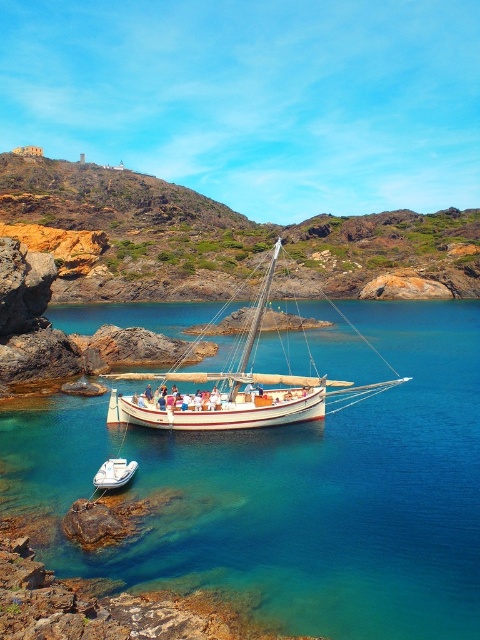
Is clear blue water at center further to the viewer compared to rustic stone cliff at upper left?

No, it is not.

The height and width of the screenshot is (640, 480). What are the coordinates of `clear blue water at center` in the screenshot? It's located at (297, 492).

Measure the distance between white wooden sailboat at center and camera.

white wooden sailboat at center is 59.24 meters away from camera.

Which is behind, point (252, 316) or point (134, 472)?

Point (252, 316)

Image resolution: width=480 pixels, height=640 pixels. Identify the location of white wooden sailboat at center. (236, 392).

Can you confirm if rustic stone cliff at upper left is positioned to the left of white matte dinghy at lower left?

Indeed, rustic stone cliff at upper left is positioned on the left side of white matte dinghy at lower left.

Who is positioned more to the left, rustic stone cliff at upper left or white matte dinghy at lower left?

rustic stone cliff at upper left

Between point (326, 253) and point (112, 484), which one is positioned behind?

Point (326, 253)

The width and height of the screenshot is (480, 640). I want to click on rustic stone cliff at upper left, so click(x=222, y=237).